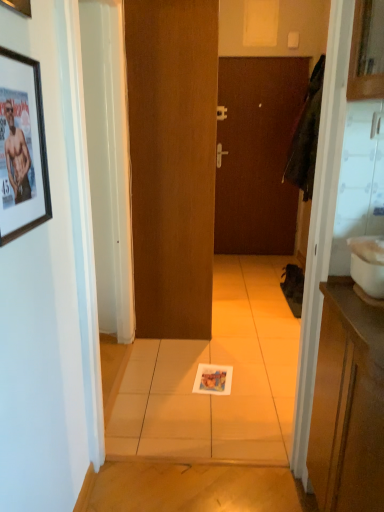
Question: From the image's perspective, is brown matte door at center, marked as the 1th door in a back-to-front arrangement, above or below matte black picture frame at upper left, the 1th picture frame from the bottom?

Choices:
 (A) below
 (B) above

Answer: (B)

Question: Visually, is brown matte door at center, marked as the 1th door in a back-to-front arrangement, positioned to the left or to the right of matte black picture frame at upper left, the 1th picture frame from the bottom?

Choices:
 (A) right
 (B) left

Answer: (A)

Question: Which is nearer to the white glossy sink at right?

Choices:
 (A) brown matte door at center, the first door positioned from the right
 (B) brushed metal picture frame at upper left, which appears as the first picture frame when viewed from the top
 (C) matte paper magazine at center
 (D) matte black picture frame at upper left, the 1th picture frame from the bottom
 (E) brown matte door at center, the 2th door viewed from the back

Answer: (D)

Question: Based on their relative distances, which object is nearer to the white glossy sink at right?

Choices:
 (A) brown matte door at center, which is the 2th door in front-to-back order
 (B) matte black picture frame at upper left, which is the 2th picture frame from top to bottom
 (C) brown matte door at center, the 2th door viewed from the back
 (D) matte paper magazine at center
 (E) brushed metal picture frame at upper left, which appears as the first picture frame when viewed from the top

Answer: (B)